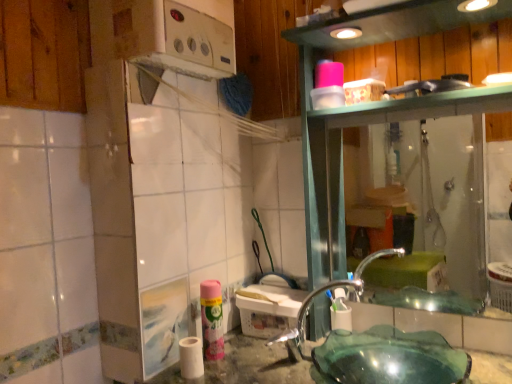
Identify the location of transparent glass shower at right. (422, 212).

In order to face pink matte spray can at lower center, should I rotate leftwards or rightwards?

Rotate your view left by about 5.769°.

Identify the location of clear glass faucet at lower center. (306, 315).

Considering the sizes of objects white matte toilet paper at lower center and clear glass faucet at lower center in the image provided, who is taller, white matte toilet paper at lower center or clear glass faucet at lower center?

clear glass faucet at lower center.

Considering the positions of objects white matte toilet paper at lower center and clear glass faucet at lower center in the image provided, who is behind, white matte toilet paper at lower center or clear glass faucet at lower center?

Positioned behind is white matte toilet paper at lower center.

At what (x,y) coordinates should I click in order to perform the action: click on faucet in front of the white matte toilet paper at lower center. Please return your answer as a coordinate pair (x, y). Looking at the image, I should click on (306, 315).

Measure the distance between white matte toilet paper at lower center and clear glass faucet at lower center.

The distance of white matte toilet paper at lower center from clear glass faucet at lower center is 14.39 inches.

From a real-world perspective, which object stands above the other?

pink matte spray can at lower center.

Which is closer, (199,373) or (215,338)?

Clearly, point (199,373) is closer to the camera than point (215,338).

Can you confirm if clear glass faucet at lower center is smaller than pink matte shaving cream at lower center?

Actually, clear glass faucet at lower center might be larger than pink matte shaving cream at lower center.

Is point (279, 338) behind point (343, 294)?

No, it is not.

Considering the relative sizes of clear glass faucet at lower center and pink matte shaving cream at lower center in the image provided, is clear glass faucet at lower center taller than pink matte shaving cream at lower center?

Correct, clear glass faucet at lower center is much taller as pink matte shaving cream at lower center.

Would you say clear glass faucet at lower center is inside or outside pink matte shaving cream at lower center?

clear glass faucet at lower center is located beyond the bounds of pink matte shaving cream at lower center.

In the scene shown: Are clear glass faucet at lower center and pink matte spray can at lower center far apart?

clear glass faucet at lower center is actually quite close to pink matte spray can at lower center.

Which object is further away from the camera, clear glass faucet at lower center or pink matte spray can at lower center?

pink matte spray can at lower center is further away from the camera.

Does clear glass faucet at lower center appear on the right side of pink matte spray can at lower center?

Yes.

Is point (214, 284) more distant than point (269, 340)?

No, it is not.

From the picture: Is pink matte spray can at lower center spatially inside clear glass faucet at lower center, or outside of it?

pink matte spray can at lower center lies outside clear glass faucet at lower center.

What's the angular difference between pink matte spray can at lower center and clear glass faucet at lower center's facing directions?

The facing directions of pink matte spray can at lower center and clear glass faucet at lower center are 1.7 degrees apart.

Considering the positions of objects transparent glass shower at right and clear glass faucet at lower center in the image provided, who is in front, transparent glass shower at right or clear glass faucet at lower center?

clear glass faucet at lower center is closer to the camera.

From a real-world perspective, is transparent glass shower at right physically located above or below clear glass faucet at lower center?

In terms of real-world spatial position, transparent glass shower at right is above clear glass faucet at lower center.

Which is correct: transparent glass shower at right is inside clear glass faucet at lower center, or outside of it?

transparent glass shower at right is not inside clear glass faucet at lower center, it's outside.

The image size is (512, 384). What are the coordinates of `mirror located on the right of clear glass faucet at lower center` in the screenshot? It's located at (422, 212).

From a real-world perspective, is pink matte spray can at lower center physically below transparent glass shower at right?

Yes, from a real-world perspective, pink matte spray can at lower center is under transparent glass shower at right.

Would you say pink matte spray can at lower center is outside transparent glass shower at right?

pink matte spray can at lower center lies outside transparent glass shower at right's area.

Which object is positioned more to the right, pink matte spray can at lower center or transparent glass shower at right?

From the viewer's perspective, transparent glass shower at right appears more on the right side.

Which is behind, point (208, 300) or point (374, 243)?

The point (374, 243) is farther.

Locate an element on the screen. The image size is (512, 384). faucet in front of the white matte toilet paper at lower center is located at coordinates (306, 315).

Where is `toilet paper beneath the pink matte spray can at lower center (from a real-world perspective)`? The image size is (512, 384). toilet paper beneath the pink matte spray can at lower center (from a real-world perspective) is located at coordinates (191, 357).

In the scene shown: Estimate the real-world distances between objects in this image. Which object is further from clear glass faucet at lower center, pink matte spray can at lower center or pink matte shaving cream at lower center?

Based on the image, pink matte spray can at lower center appears to be further to clear glass faucet at lower center.

From the image, which object appears to be nearer to transparent glass shower at right, pink matte shaving cream at lower center or pink matte spray can at lower center?

pink matte shaving cream at lower center is positioned closer to the anchor transparent glass shower at right.

Which object lies further to the anchor point clear glass faucet at lower center, transparent glass shower at right or white matte toilet paper at lower center?

Among the two, transparent glass shower at right is located further to clear glass faucet at lower center.

Looking at this image, from the image, which object appears to be nearer to pink matte shaving cream at lower center, pink matte spray can at lower center or transparent glass shower at right?

pink matte spray can at lower center is closer to pink matte shaving cream at lower center.

When comparing their distances from clear glass faucet at lower center, does pink matte shaving cream at lower center or white matte toilet paper at lower center seem further?

Among the two, white matte toilet paper at lower center is located further to clear glass faucet at lower center.

From the image, which object appears to be farther from transparent glass shower at right, white matte toilet paper at lower center or green glass sink at lower center?

The object further to transparent glass shower at right is white matte toilet paper at lower center.

Which object lies further to the anchor point green glass sink at lower center, white matte toilet paper at lower center or clear glass faucet at lower center?

white matte toilet paper at lower center is positioned further to the anchor green glass sink at lower center.

Based on their spatial positions, is white matte toilet paper at lower center or pink matte spray can at lower center closer to pink matte shaving cream at lower center?

Based on the image, pink matte spray can at lower center appears to be nearer to pink matte shaving cream at lower center.

I want to click on faucet between transparent glass shower at right and pink matte shaving cream at lower center from top to bottom, so click(x=306, y=315).

Where is `faucet between white matte toilet paper at lower center and green glass sink at lower center from left to right`? The width and height of the screenshot is (512, 384). faucet between white matte toilet paper at lower center and green glass sink at lower center from left to right is located at coordinates [306, 315].

Where is `faucet between green glass sink at lower center and pink matte shaving cream at lower center along the z-axis`? Image resolution: width=512 pixels, height=384 pixels. faucet between green glass sink at lower center and pink matte shaving cream at lower center along the z-axis is located at coordinates (306, 315).

Locate an element on the screen. The image size is (512, 384). shaving cream between white matte toilet paper at lower center and transparent glass shower at right from left to right is located at coordinates (340, 312).